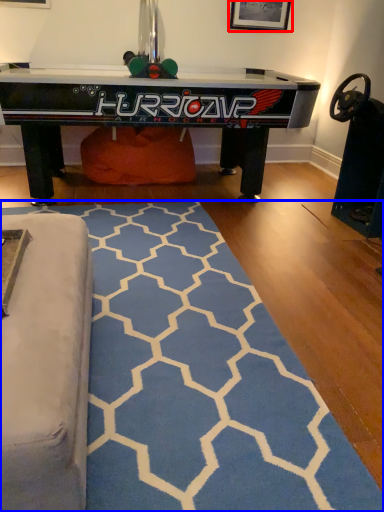
Question: Which of the following is the closest to the observer, picture frame (highlighted by a red box) or mat (highlighted by a blue box)?

Choices:
 (A) picture frame
 (B) mat

Answer: (B)